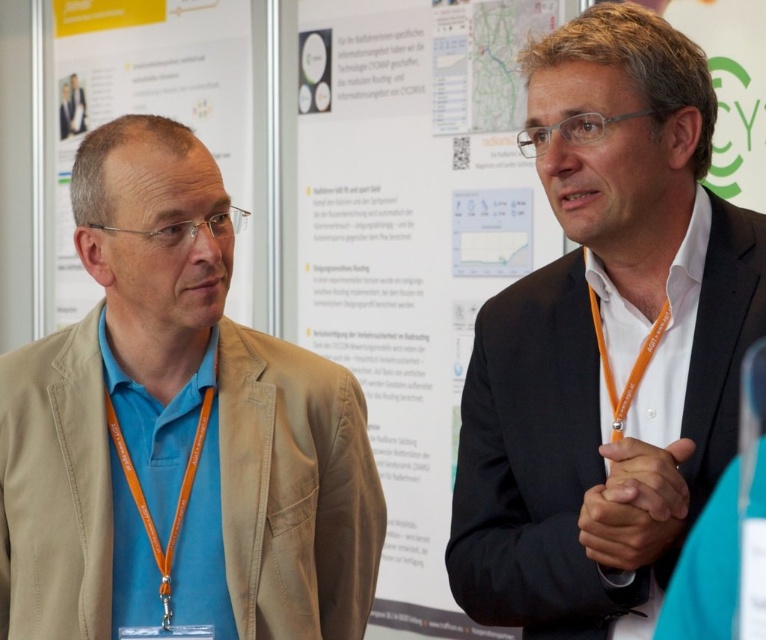
Question: Which object is the closest to the matte black suit at right?

Choices:
 (A) white paper poster at center
 (B) blue fabric shirt at left
 (C) orange fabric lanyard at left
 (D) white paper at upper left

Answer: (B)

Question: Where is white paper poster at center located in relation to orange fabric lanyard at left in the image?

Choices:
 (A) below
 (B) above

Answer: (B)

Question: Can you confirm if blue fabric shirt at left is positioned below orange fabric lanyard at left?

Choices:
 (A) no
 (B) yes

Answer: (A)

Question: Which is farther from the blue fabric shirt at left?

Choices:
 (A) white paper at upper left
 (B) orange fabric lanyard at left
 (C) white paper poster at center
 (D) matte black suit at right

Answer: (A)

Question: Which is farther from the orange fabric lanyard at left?

Choices:
 (A) matte black suit at right
 (B) white paper poster at center
 (C) blue fabric shirt at left

Answer: (B)

Question: Is matte black suit at right wider than white paper at upper left?

Choices:
 (A) no
 (B) yes

Answer: (A)